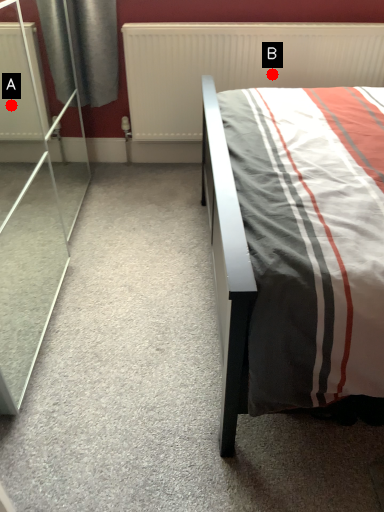
Question: Two points are circled on the image, labeled by A and B beside each circle. Which point is farther to the camera?

Choices:
 (A) A is further
 (B) B is further

Answer: (A)